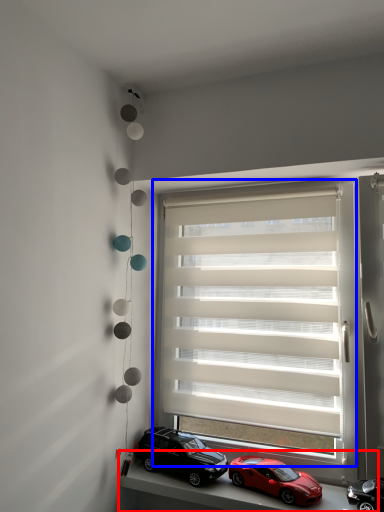
Question: Which point is closer to the camera, window sill (highlighted by a red box) or window blind (highlighted by a blue box)?

Choices:
 (A) window sill
 (B) window blind

Answer: (A)